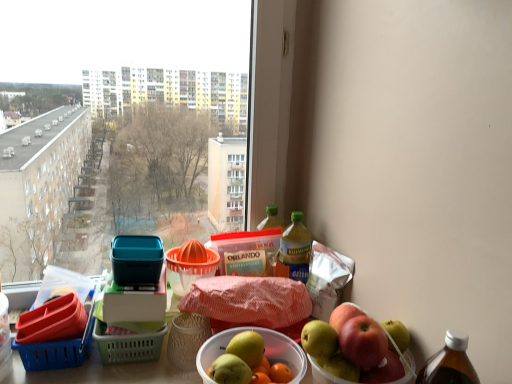
Question: Does translucent plastic bottle at upper right, which ranks as the second bottle in right-to-left order, lie behind shiny red apple at right?

Choices:
 (A) no
 (B) yes

Answer: (B)

Question: From a real-world perspective, does translucent plastic bottle at upper right, which ranks as the second bottle in right-to-left order, sit lower than shiny red apple at right?

Choices:
 (A) no
 (B) yes

Answer: (A)

Question: Are translucent plastic bottle at upper right, which ranks as the second bottle in right-to-left order, and shiny red apple at right beside each other?

Choices:
 (A) no
 (B) yes

Answer: (A)

Question: Is translucent plastic bottle at upper right, marked as the first bottle in a left-to-right arrangement, closer to the viewer compared to shiny red apple at right?

Choices:
 (A) no
 (B) yes

Answer: (A)

Question: Can you confirm if translucent plastic bottle at upper right, marked as the first bottle in a left-to-right arrangement, is positioned to the left of shiny red apple at right?

Choices:
 (A) yes
 (B) no

Answer: (A)

Question: Would you say translucent plastic bottle at upper right, which ranks as the second bottle in right-to-left order, is outside shiny red apple at right?

Choices:
 (A) no
 (B) yes

Answer: (B)

Question: Is the depth of blue plastic basket at lower left, the 1th basket when ordered from left to right, greater than that of yellow translucent bottle at upper right, the 2th bottle from the left?

Choices:
 (A) yes
 (B) no

Answer: (B)

Question: Is yellow translucent bottle at upper right, arranged as the first bottle when viewed from the right, completely or partially inside blue plastic basket at lower left, the second basket when ordered from top to bottom?

Choices:
 (A) yes
 (B) no

Answer: (B)

Question: From a real-world perspective, is blue plastic basket at lower left, the second basket when ordered from top to bottom, positioned over yellow translucent bottle at upper right, the 2th bottle from the left, based on gravity?

Choices:
 (A) yes
 (B) no

Answer: (B)

Question: Is blue plastic basket at lower left, which is the first basket from bottom to top, not close to yellow translucent bottle at upper right, the 2th bottle from the left?

Choices:
 (A) yes
 (B) no

Answer: (B)

Question: Can you confirm if blue plastic basket at lower left, the 1th basket when ordered from left to right, is taller than yellow translucent bottle at upper right, the 2th bottle from the left?

Choices:
 (A) yes
 (B) no

Answer: (B)

Question: Can you confirm if blue plastic basket at lower left, the 1th basket when ordered from left to right, is positioned to the right of yellow translucent bottle at upper right, the 2th bottle from the left?

Choices:
 (A) no
 (B) yes

Answer: (A)

Question: Does translucent plastic bottle at upper right, marked as the first bottle in a left-to-right arrangement, appear on the right side of yellow translucent bottle at upper right, arranged as the first bottle when viewed from the right?

Choices:
 (A) no
 (B) yes

Answer: (A)